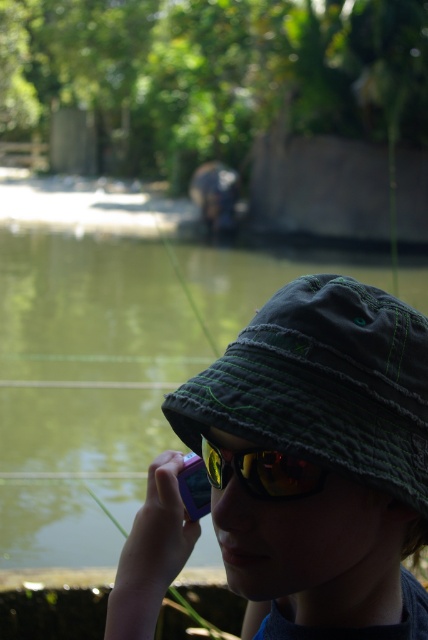
Question: Which of the following is the farthest from the observer?

Choices:
 (A) yellow reflective lens at center
 (B) matte green bucket hat at center

Answer: (A)

Question: Is matte green bucket hat at center in front of yellow reflective lens at center?

Choices:
 (A) no
 (B) yes

Answer: (B)

Question: Is matte green bucket hat at center wider than yellow reflective lens at center?

Choices:
 (A) yes
 (B) no

Answer: (A)

Question: Which object appears closest to the camera in this image?

Choices:
 (A) yellow reflective lens at center
 (B) matte green bucket hat at center

Answer: (B)

Question: Is matte green bucket hat at center further to the viewer compared to yellow reflective lens at center?

Choices:
 (A) no
 (B) yes

Answer: (A)

Question: Which of the following is the closest to the observer?

Choices:
 (A) matte green bucket hat at center
 (B) yellow reflective lens at center

Answer: (A)